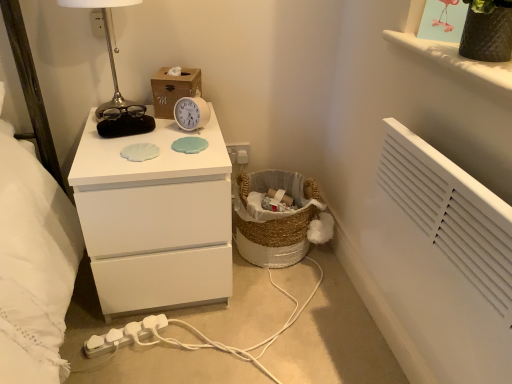
Identify the location of free space in front of white plastic extension cord at lower left. (122, 369).